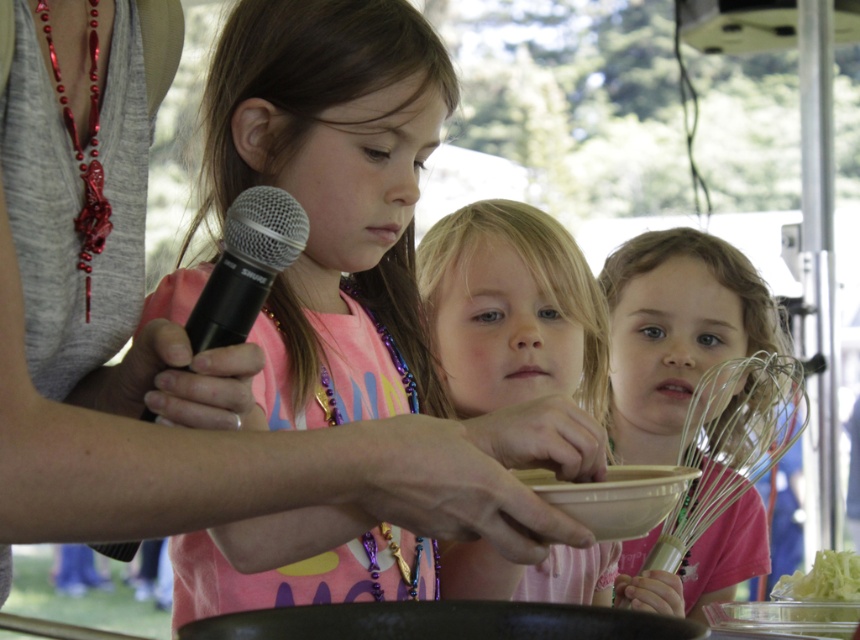
You are a child in the scene and want to place the black plastic microphone at upper center and the white matte bowl at center on a shelf. Which object should you place first if you want to put the taller item on the lower shelf?

The black plastic microphone at upper center is much taller than the white matte bowl at center, so you should place the black plastic microphone at upper center first on the lower shelf.

You are a photographer standing in front of the scene. You want to take a photo of the smooth pink shirt at center and the metallic silver whisk at lower right. Which object should you focus on first to ensure both are in sharp focus?

You should focus on the smooth pink shirt at center first because it is closer to the viewer than the metallic silver whisk at lower right, ensuring both will be in focus when using a shallow depth of field.

In the scene shown: You are a chef preparing a salad and need to determine which container to use. You have the white matte bowl at center and the green leafy lettuce at lower right. Based on their sizes, which one is wider?

The green leafy lettuce at lower right is wider than the white matte bowl at center, so you should use the green leafy lettuce at lower right as the container for the salad.